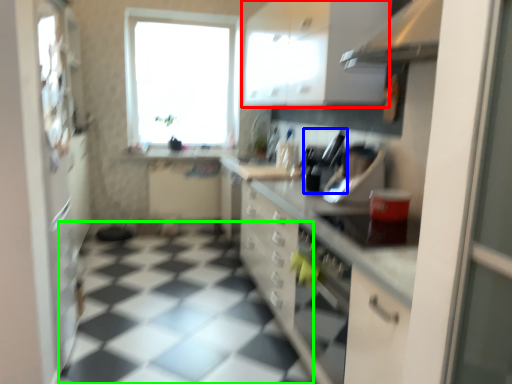
Question: Considering the real-world distances, which object is closest to cabinetry (highlighted by a red box)? appliance (highlighted by a blue box) or tile (highlighted by a green box).

Choices:
 (A) appliance
 (B) tile

Answer: (A)